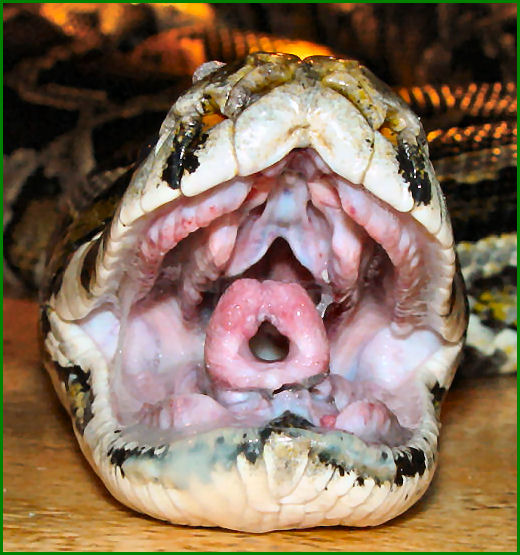
You are a GUI agent. You are given a task and a screenshot of the screen. Output one action in this format:
    pyautogui.click(x=<x>, y=<y>)
    Task: Click on the brown wooden floor
    The image size is (520, 555).
    Given the screenshot: What is the action you would take?
    pyautogui.click(x=472, y=502)